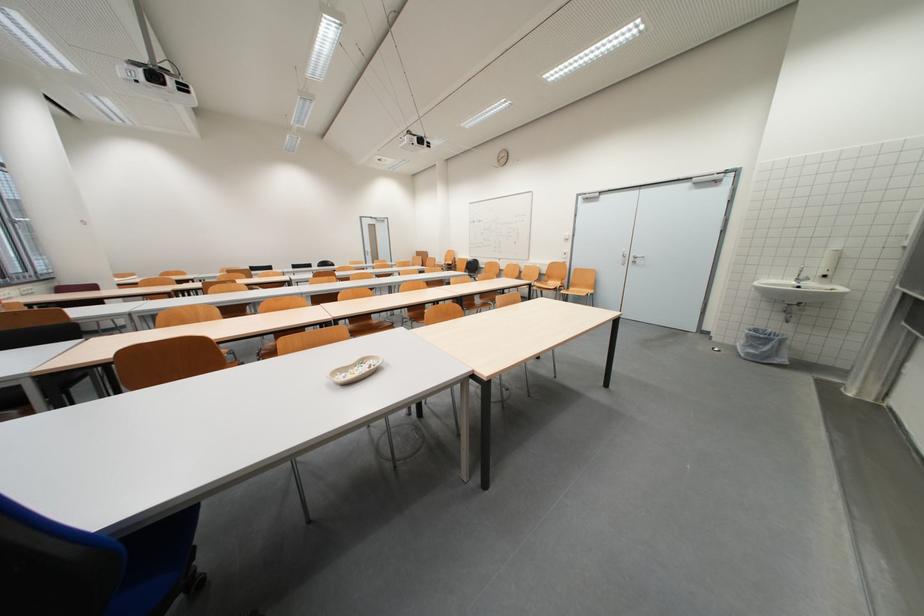
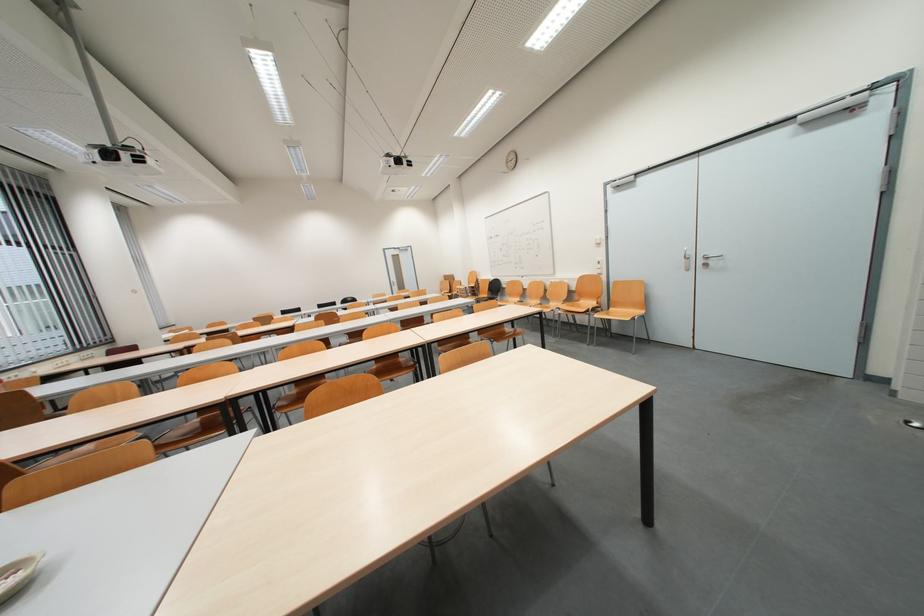
Locate, in the second image, the point that corresponds to point 419,318 in the first image.

(386, 370)